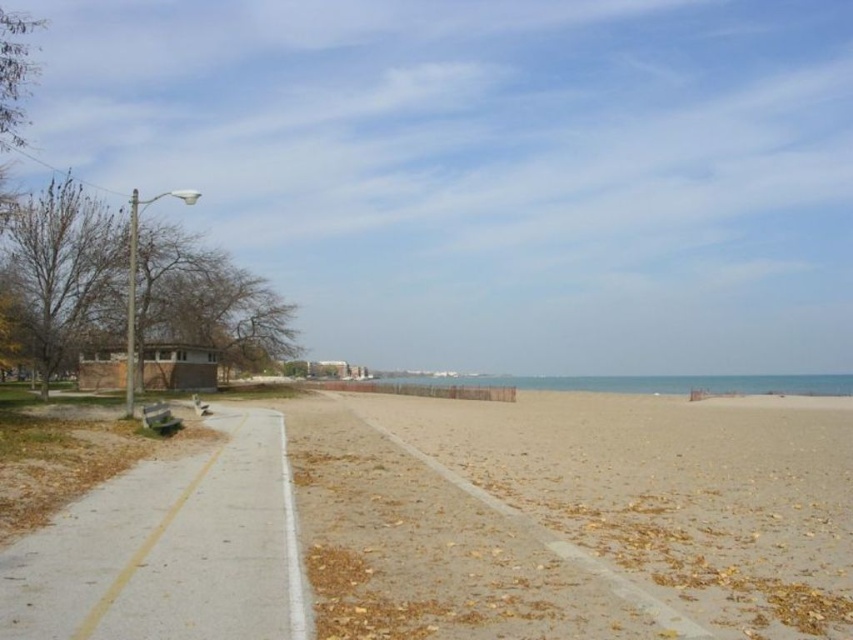
Question: Among these objects, which one is nearest to the camera?

Choices:
 (A) concrete at left
 (B) wooden park bench at lower left

Answer: (A)

Question: Which of the following is the farthest from the observer?

Choices:
 (A) (286, 612)
 (B) (165, 416)

Answer: (B)

Question: Which object is closer to the camera taking this photo?

Choices:
 (A) wooden park bench at lower left
 (B) brown sandy beach at center

Answer: (B)

Question: Observing the image, what is the correct spatial positioning of concrete at left in reference to wooden park bench at lower left?

Choices:
 (A) left
 (B) right

Answer: (B)

Question: Is concrete at left closer to the viewer compared to wooden park bench at lower left?

Choices:
 (A) yes
 (B) no

Answer: (A)

Question: Does concrete at left appear on the left side of wooden park bench at lower left?

Choices:
 (A) yes
 (B) no

Answer: (B)